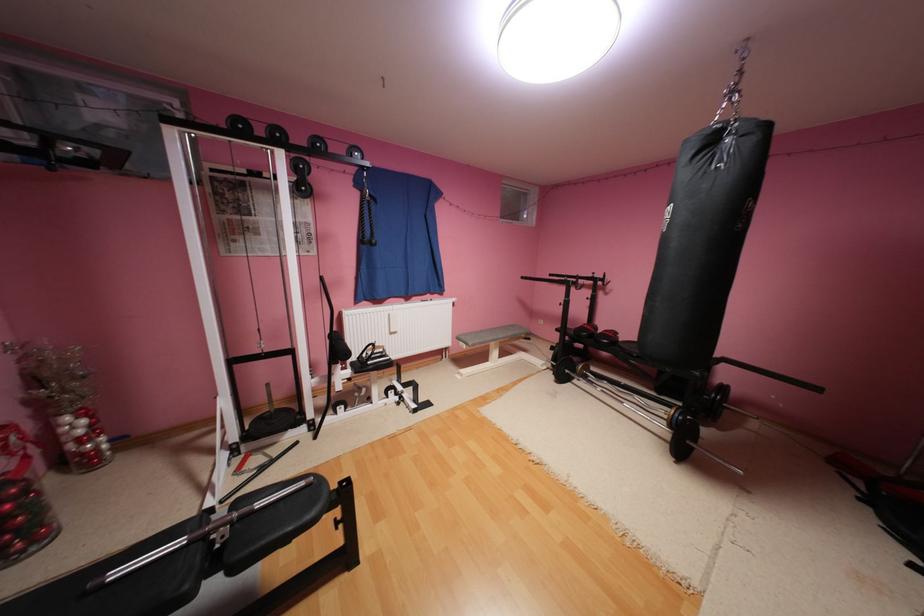
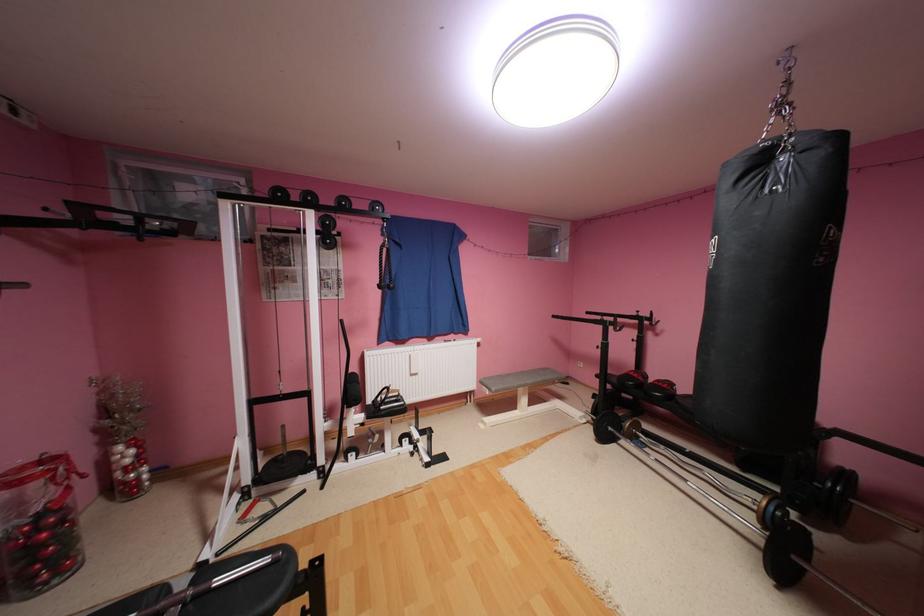
In the second image, find the point that corresponds to point (320, 415) in the first image.

(331, 460)